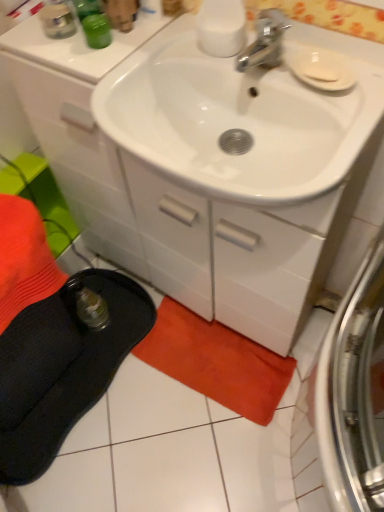
Question: Is orange cotton beach towel at lower center oriented towards white matte soap at upper right?

Choices:
 (A) no
 (B) yes

Answer: (A)

Question: Considering the relative positions of orange cotton beach towel at lower center and white matte soap at upper right in the image provided, is orange cotton beach towel at lower center in front of white matte soap at upper right?

Choices:
 (A) yes
 (B) no

Answer: (B)

Question: From a real-world perspective, is orange cotton beach towel at lower center beneath white matte soap at upper right?

Choices:
 (A) yes
 (B) no

Answer: (A)

Question: Is orange cotton beach towel at lower center smaller than white matte soap at upper right?

Choices:
 (A) yes
 (B) no

Answer: (B)

Question: Is orange cotton beach towel at lower center taller than white matte soap at upper right?

Choices:
 (A) no
 (B) yes

Answer: (B)

Question: From the image's perspective, does orange cotton beach towel at lower center appear lower than white matte soap at upper right?

Choices:
 (A) no
 (B) yes

Answer: (B)

Question: Is white glossy cabinet at center thinner than orange cotton beach towel at lower center?

Choices:
 (A) yes
 (B) no

Answer: (B)

Question: Is white glossy cabinet at center taller than orange cotton beach towel at lower center?

Choices:
 (A) no
 (B) yes

Answer: (B)

Question: Can you confirm if white glossy cabinet at center is wider than orange cotton beach towel at lower center?

Choices:
 (A) no
 (B) yes

Answer: (B)

Question: Is white glossy cabinet at center beside orange cotton beach towel at lower center?

Choices:
 (A) no
 (B) yes

Answer: (A)

Question: Considering the relative positions of white glossy cabinet at center and orange cotton beach towel at lower center in the image provided, is white glossy cabinet at center to the left of orange cotton beach towel at lower center from the viewer's perspective?

Choices:
 (A) yes
 (B) no

Answer: (A)

Question: From the image's perspective, does white glossy cabinet at center appear lower than orange cotton beach towel at lower center?

Choices:
 (A) no
 (B) yes

Answer: (A)

Question: Considering the relative sizes of white matte soap at upper right and orange cotton beach towel at lower center in the image provided, is white matte soap at upper right wider than orange cotton beach towel at lower center?

Choices:
 (A) no
 (B) yes

Answer: (A)